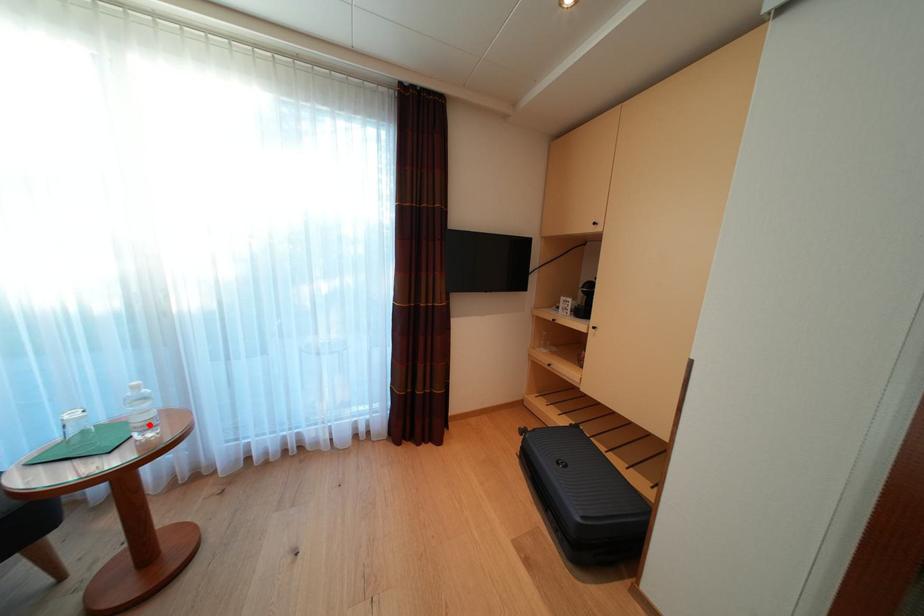
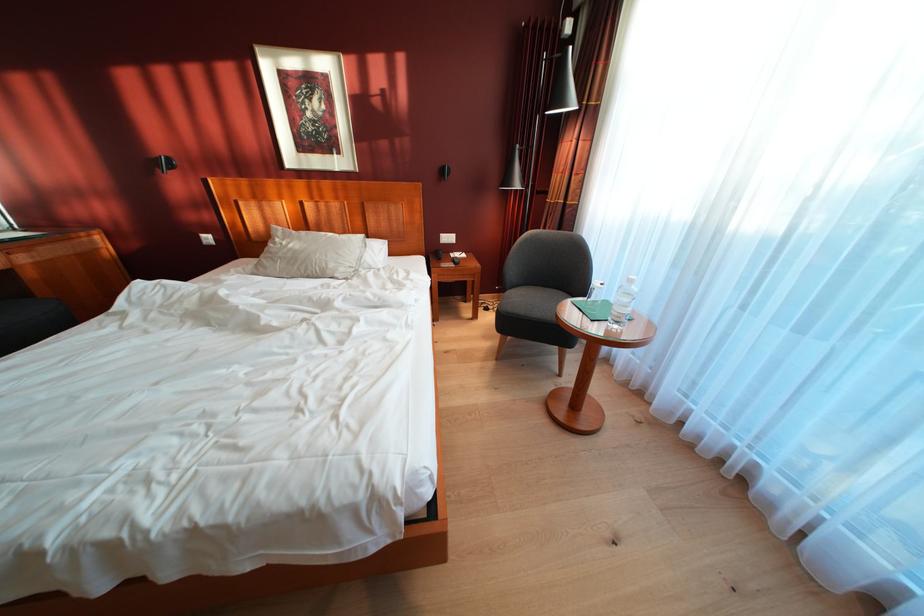
Question: A red point is marked in image1. In image2, is the corresponding 3D point closer to the camera or farther? Reply with the corresponding letter.

Choices:
 (A) The corresponding 3D point is closer.
 (B) The corresponding 3D point is farther.

Answer: (A)